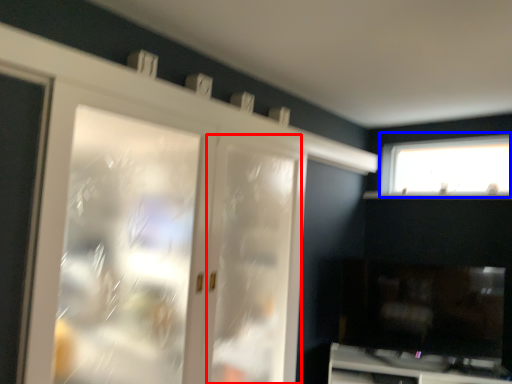
Question: Among these objects, which one is farthest to the camera, screen door (highlighted by a red box) or window (highlighted by a blue box)?

Choices:
 (A) screen door
 (B) window

Answer: (B)